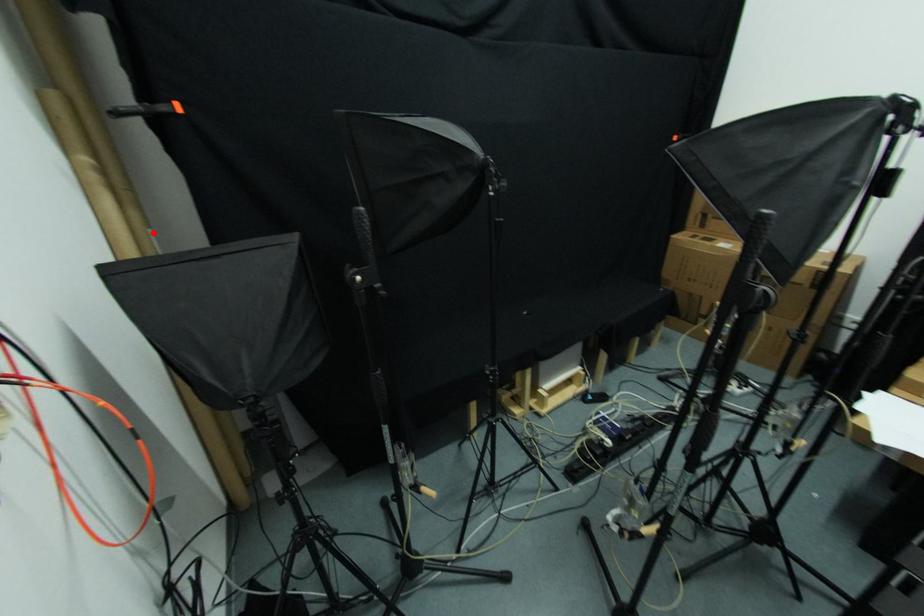
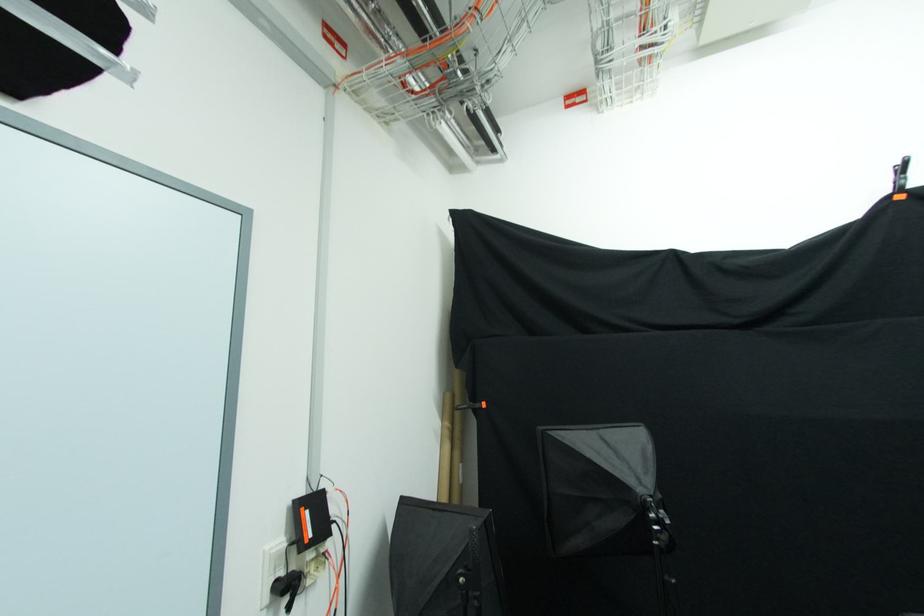
Locate, in the second image, the point that corresponds to the highlighted location in the first image.

(462, 468)